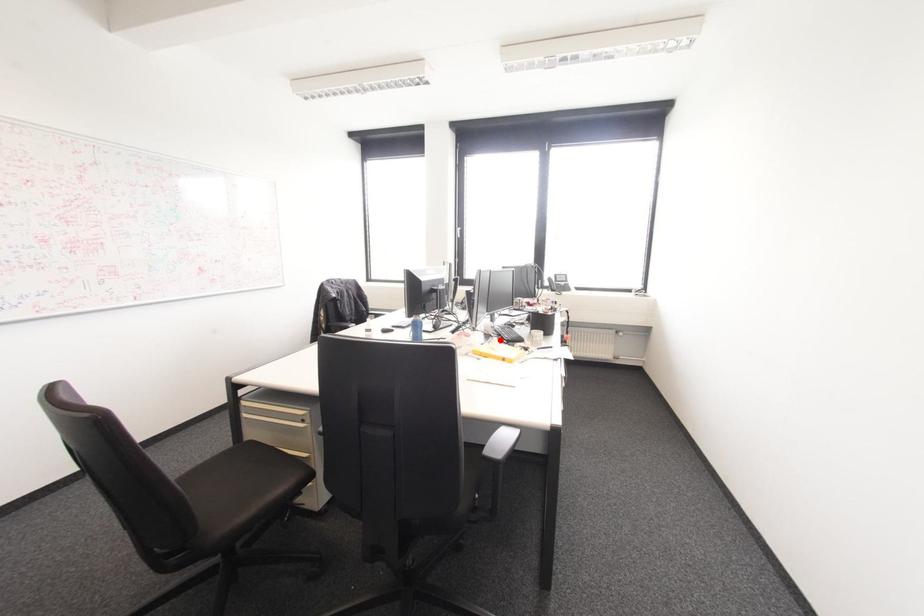
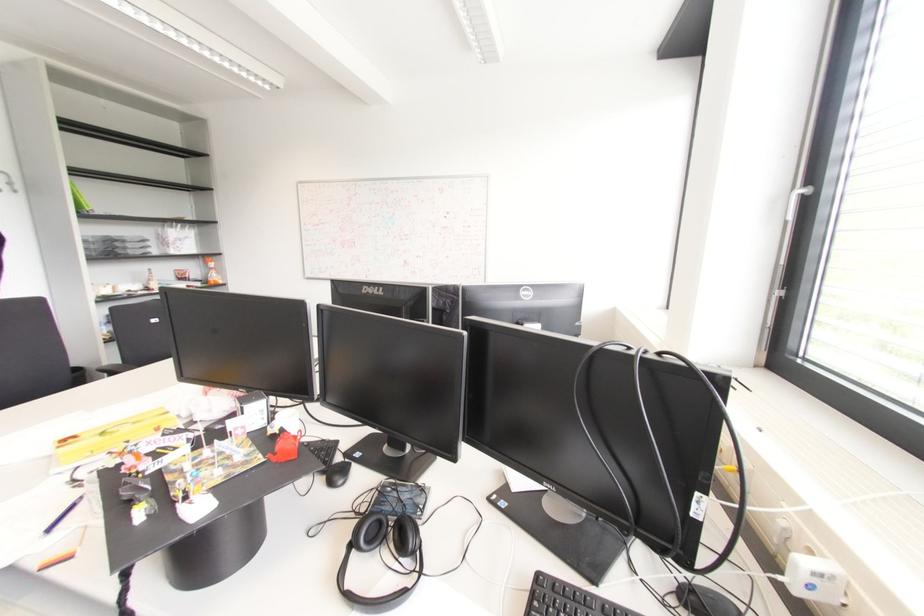
Question: I am providing you with two images of the same scene from different viewpoints. A red point is marked on the first image. Is the red point's position out of view in image 2?

Choices:
 (A) Yes
 (B) No

Answer: (A)